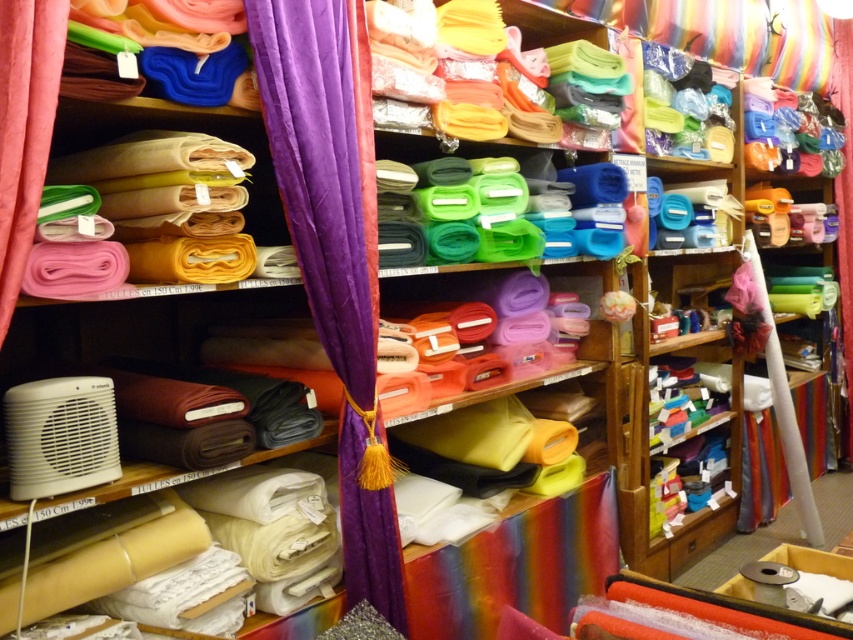
From the picture: Who is shorter, purple velvet curtain at center or pink fabric at left?

With less height is pink fabric at left.

Measure the distance between purple velvet curtain at center and camera.

purple velvet curtain at center is 5.16 feet away from camera.

Where is `purple velvet curtain at center`? This screenshot has height=640, width=853. purple velvet curtain at center is located at coordinates 335,252.